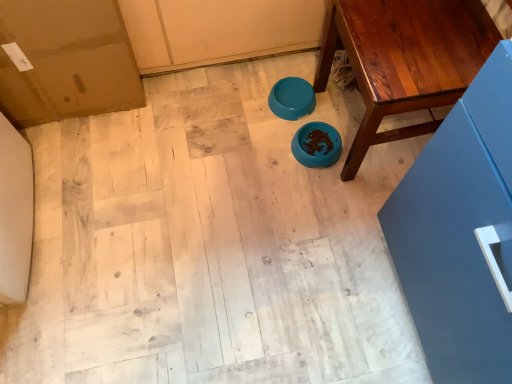
Question: From a real-world perspective, is teal glossy bowl at center, the first bowl when ordered from top to bottom, beneath wooden table at center?

Choices:
 (A) no
 (B) yes

Answer: (B)

Question: From the image's perspective, does teal glossy bowl at center, the first bowl when ordered from top to bottom, appear lower than wooden table at center?

Choices:
 (A) yes
 (B) no

Answer: (A)

Question: Is teal glossy bowl at center, the first bowl when ordered from top to bottom, closer to camera compared to wooden table at center?

Choices:
 (A) no
 (B) yes

Answer: (A)

Question: Can you confirm if teal glossy bowl at center, the first bowl when ordered from top to bottom, is bigger than wooden table at center?

Choices:
 (A) no
 (B) yes

Answer: (A)

Question: Can you confirm if teal glossy bowl at center, the first bowl when ordered from top to bottom, is taller than wooden table at center?

Choices:
 (A) yes
 (B) no

Answer: (B)

Question: From a real-world perspective, is teal glossy bowl at center, the first bowl when ordered from top to bottom, positioned over wooden table at center based on gravity?

Choices:
 (A) yes
 (B) no

Answer: (B)

Question: Does blue matte bowl at center, marked as the 1th bowl in a bottom-to-top arrangement, have a lesser width compared to wooden table at center?

Choices:
 (A) yes
 (B) no

Answer: (A)

Question: Is the depth of blue matte bowl at center, the second bowl in the top-to-bottom sequence, less than that of wooden table at center?

Choices:
 (A) yes
 (B) no

Answer: (B)

Question: Are blue matte bowl at center, marked as the 1th bowl in a bottom-to-top arrangement, and wooden table at center far apart?

Choices:
 (A) yes
 (B) no

Answer: (B)

Question: From the image's perspective, is blue matte bowl at center, the second bowl in the top-to-bottom sequence, below wooden table at center?

Choices:
 (A) yes
 (B) no

Answer: (A)

Question: Does blue matte bowl at center, marked as the 1th bowl in a bottom-to-top arrangement, have a greater height compared to wooden table at center?

Choices:
 (A) no
 (B) yes

Answer: (A)

Question: Is blue matte bowl at center, marked as the 1th bowl in a bottom-to-top arrangement, beside wooden table at center?

Choices:
 (A) no
 (B) yes

Answer: (A)

Question: Is blue matte bowl at center, the second bowl in the top-to-bottom sequence, touching teal glossy bowl at center, which appears as the second bowl when ordered from the bottom?

Choices:
 (A) yes
 (B) no

Answer: (B)